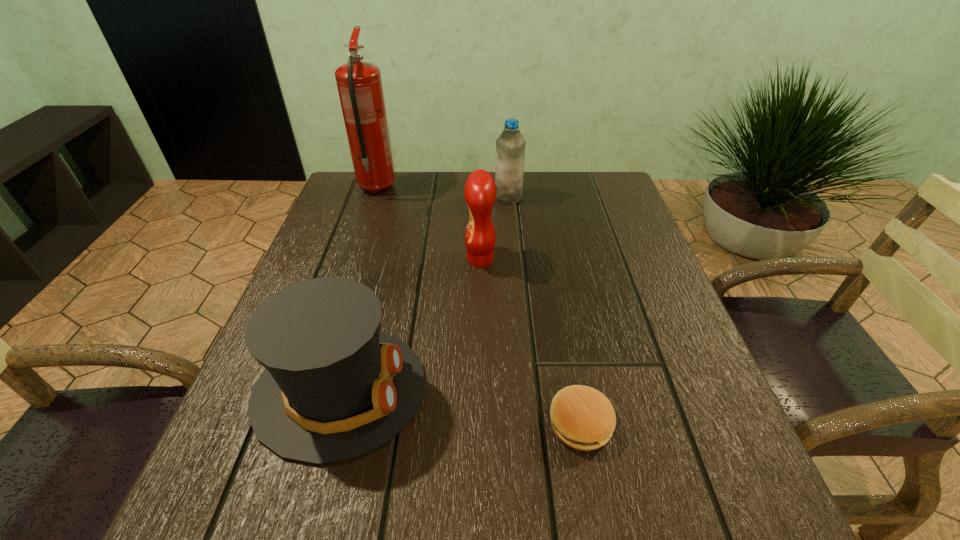
Locate an element on the screen. This screenshot has height=540, width=960. fire extinguisher is located at coordinates (359, 83).

Locate an element on the screen. water bottle is located at coordinates (510, 146).

Where is `the third farthest object`? the third farthest object is located at coordinates (480, 190).

Locate an element on the screen. The image size is (960, 540). condiment is located at coordinates [x=480, y=190].

Find the location of `dress hat`. dress hat is located at coordinates (334, 387).

This screenshot has height=540, width=960. I want to click on the shortest object, so click(x=583, y=418).

The image size is (960, 540). Find the location of `vacant region located on the right of the water bottle`. vacant region located on the right of the water bottle is located at coordinates (570, 198).

Identify the location of vacant space positioned 0.290m on the label side of the third farthest object. (337, 259).

At what (x,y) coordinates should I click in order to perform the action: click on vacant space located 0.320m on the label side of the third farthest object. Please return your answer as a coordinate pair (x, y). Looking at the image, I should click on (324, 259).

The height and width of the screenshot is (540, 960). I want to click on vacant space located 0.360m on the label side of the third farthest object, so click(305, 259).